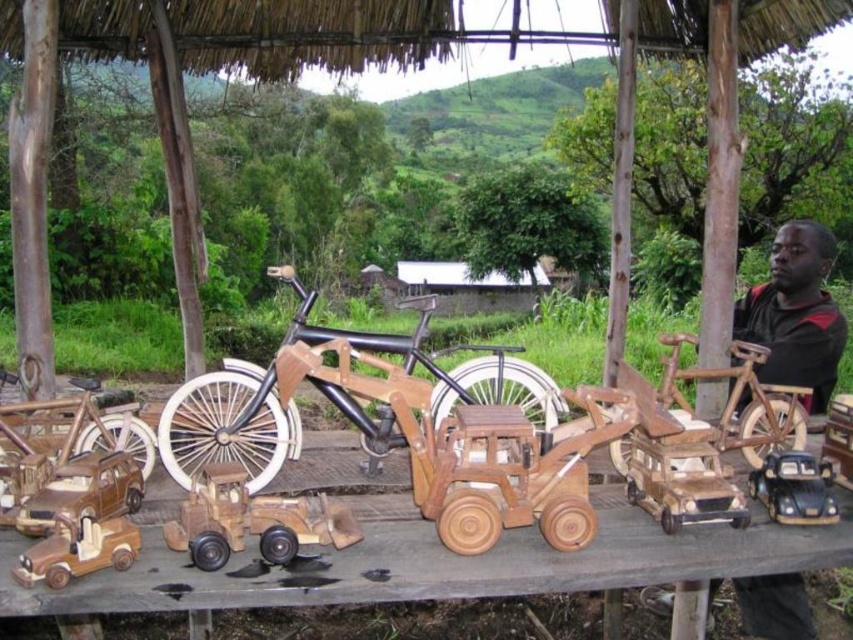
Question: Is wooden tractor at center to the right of wooden toy car at lower left from the viewer's perspective?

Choices:
 (A) no
 (B) yes

Answer: (B)

Question: Can you confirm if wooden tractor at center is bigger than wooden figure at center?

Choices:
 (A) no
 (B) yes

Answer: (A)

Question: Which of the following is the farthest from the observer?

Choices:
 (A) wooden bicycle at center
 (B) natural wood toys at center
 (C) wooden tractor at center

Answer: (A)

Question: Which of these objects is positioned closest to the wooden toy truck at center?

Choices:
 (A) wooden toy car at lower left
 (B) wooden matte truck at lower left

Answer: (B)

Question: Which object is closer to the camera taking this photo?

Choices:
 (A) wooden figure at center
 (B) wooden toy truck at center
 (C) wooden tractor at center

Answer: (B)

Question: Is natural wood toys at center above wooden bicycle at center?

Choices:
 (A) yes
 (B) no

Answer: (B)